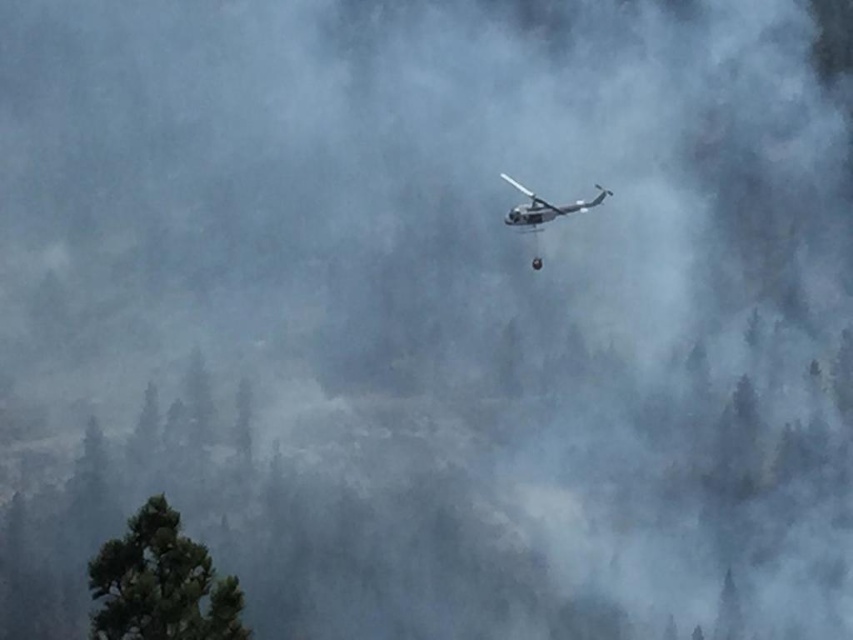
You are a firefighter pilot flying the metallic gray helicopter at center. You need to navigate around the green textured tree at lower left. Which direction should you turn to avoid it?

The green textured tree at lower left is positioned on the left side of the metallic gray helicopter at center. To avoid the tree, you should turn to the right to move away from the tree on the left.

You are a drone operator trying to navigate through the forest. You need to fly your drone from the helicopter to a safe zone located at the coordinates given by the green textured tree at lower left. What coordinates should you aim for?

The green textured tree at lower left is located at coordinates point (x=161, y=582), so you should aim for those coordinates to reach the safe zone.